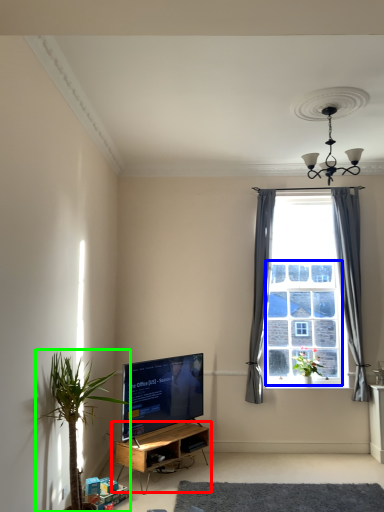
Question: Based on their relative distances, which object is farther from shelf (highlighted by a red box)? Choose from bay window (highlighted by a blue box) and houseplant (highlighted by a green box).

Choices:
 (A) bay window
 (B) houseplant

Answer: (A)